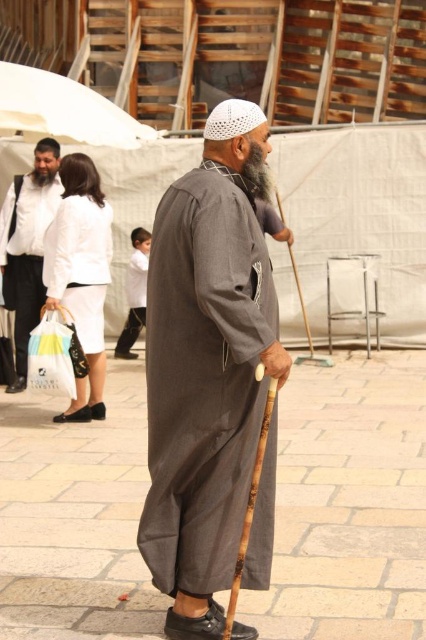
You are an observer standing in the scene. You see the white matte jacket at upper left and the white matte robe at center. Which of these two items is located more to the left?

The white matte jacket at upper left is positioned more to the left compared to the white matte robe at center.

You are a photographer trying to capture a wide shot of the elderly man and the two people in the background. The camera you are using has a limited field of view. Considering the white matte jacket at upper left and the white plastic bag at lower left, which object should you prioritize framing to ensure both are visible within the camera frame?

You should prioritize framing the white plastic bag at lower left because it is smaller in width than the white matte jacket at upper left, allowing both objects to fit within the camera frame.